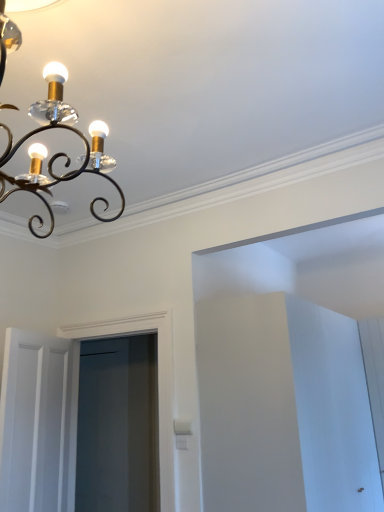
Question: Is clear glass screen door at center outside matte black chandelier at upper left?

Choices:
 (A) yes
 (B) no

Answer: (A)

Question: Is the depth of clear glass screen door at center less than that of matte black chandelier at upper left?

Choices:
 (A) no
 (B) yes

Answer: (A)

Question: Considering the relative sizes of clear glass screen door at center and matte black chandelier at upper left in the image provided, is clear glass screen door at center smaller than matte black chandelier at upper left?

Choices:
 (A) no
 (B) yes

Answer: (B)

Question: Does clear glass screen door at center have a lesser height compared to matte black chandelier at upper left?

Choices:
 (A) no
 (B) yes

Answer: (A)

Question: Is there a large distance between clear glass screen door at center and matte black chandelier at upper left?

Choices:
 (A) no
 (B) yes

Answer: (B)

Question: Considering the relative sizes of clear glass screen door at center and matte black chandelier at upper left in the image provided, is clear glass screen door at center bigger than matte black chandelier at upper left?

Choices:
 (A) no
 (B) yes

Answer: (A)

Question: Can clear glass screen door at center be found inside matte black chandelier at upper left?

Choices:
 (A) no
 (B) yes

Answer: (A)

Question: Does matte black chandelier at upper left have a larger size compared to clear glass screen door at center?

Choices:
 (A) yes
 (B) no

Answer: (A)

Question: Are matte black chandelier at upper left and clear glass screen door at center far apart?

Choices:
 (A) no
 (B) yes

Answer: (B)

Question: From a real-world perspective, is matte black chandelier at upper left physically below clear glass screen door at center?

Choices:
 (A) no
 (B) yes

Answer: (A)

Question: Can you confirm if matte black chandelier at upper left is positioned to the left of clear glass screen door at center?

Choices:
 (A) yes
 (B) no

Answer: (B)

Question: Considering the relative sizes of matte black chandelier at upper left and clear glass screen door at center in the image provided, is matte black chandelier at upper left thinner than clear glass screen door at center?

Choices:
 (A) no
 (B) yes

Answer: (A)

Question: Considering the relative sizes of clear glass screen door at center and white wooden door at lower left in the image provided, is clear glass screen door at center thinner than white wooden door at lower left?

Choices:
 (A) no
 (B) yes

Answer: (A)